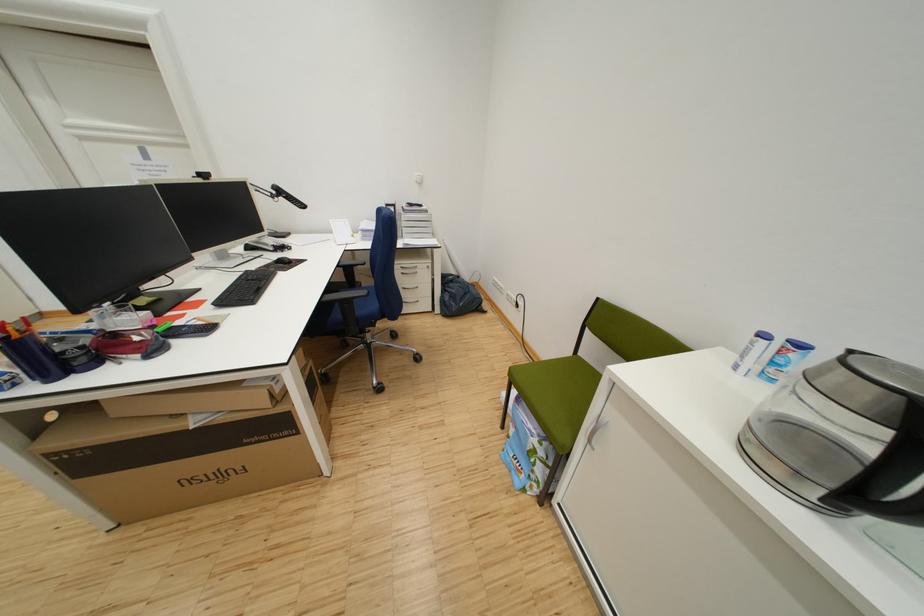
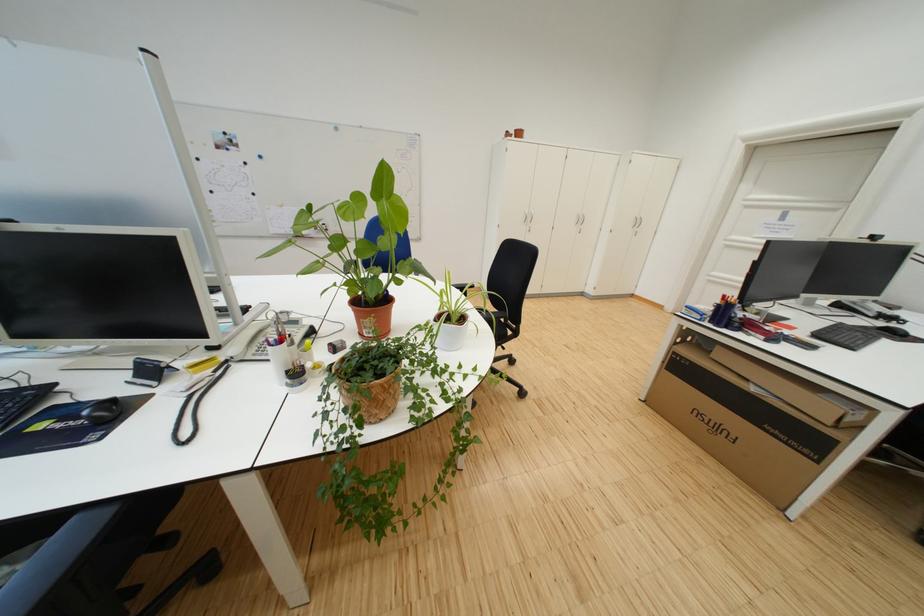
Find the pixel in the second image that matches pixel 234 477 in the first image.

(730, 431)